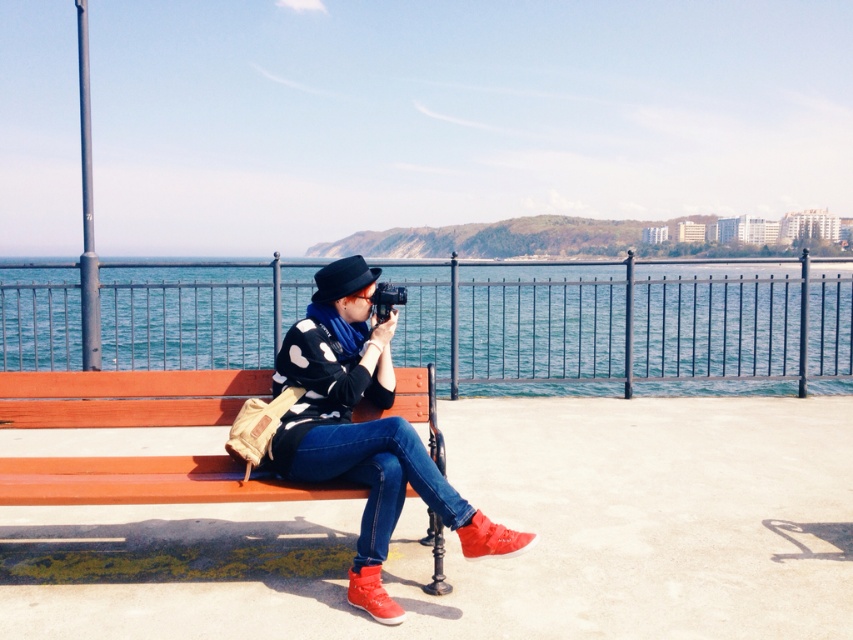
Based on the photo, you are standing on the paved walkway and want to take a photo of the wooden bench at center. However, the blue water at center is blocking your view. Can you move closer to the bench to get a clear shot without the water in the frame?

The blue water at center is further to the viewer than the wooden bench at center, so moving closer to the bench would place it between you and the water, potentially blocking the water from the frame. However, since the bench itself is your subject, you might need to adjust your position to ensure it is fully visible without the water obstructing it. Alternatively, you could move behind the bench to capture it without the water in the shot.

You are a photographer trying to capture the perfect shot of the polka dot sweater at center and the blue water at center. Based on their positions, which one should you focus on first to ensure they both are in the frame?

The blue water at center is above the polka dot sweater at center, so you should focus on the polka dot sweater at center first to ensure both are in the frame.

You are a photographer trying to capture the scene from the perspective of the person holding the camera. Which object, the blue water at center or the polka dot sweater at center, would appear to be on the left side of the photo?

The blue water at center would appear on the left side of the photo because it is positioned on the left side of the polka dot sweater at center.